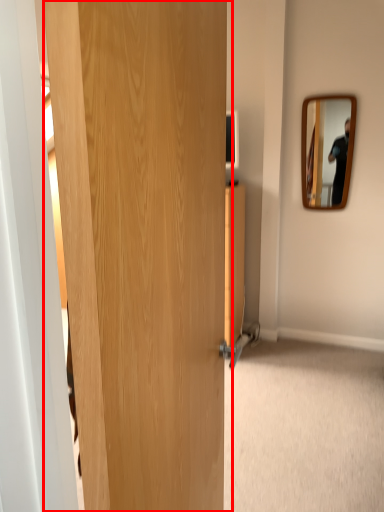
Question: From the image's perspective, considering the relative positions of door (annotated by the red box) and mirror in the image provided, where is door (annotated by the red box) located with respect to the staircase?

Choices:
 (A) above
 (B) below

Answer: (B)